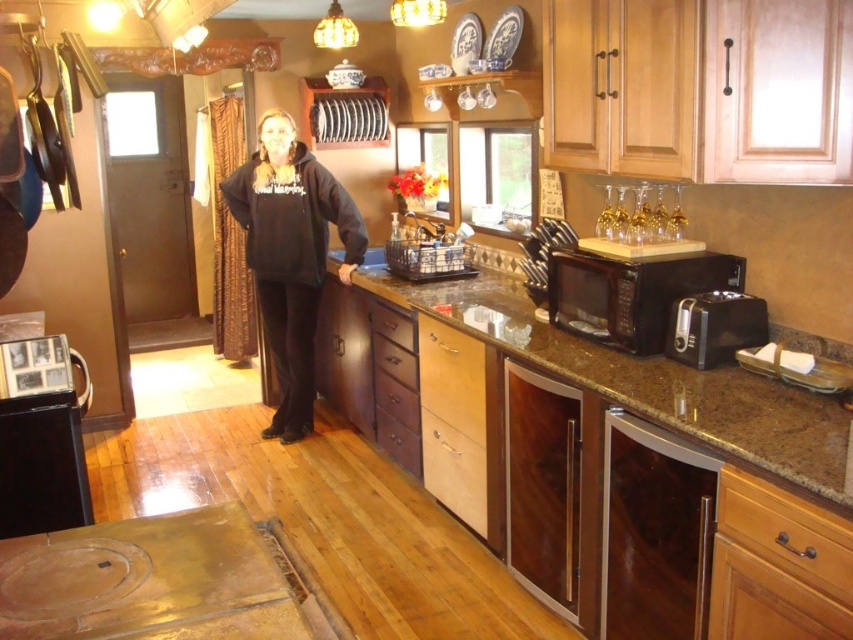
You are standing in the kitchen and want to load dishes into the satin stainless steel dishwasher at lower right. If your reach is 6 feet, can you place dishes into it without moving closer?

The satin stainless steel dishwasher at lower right is 6.21 feet away from you, which is slightly beyond your 6 feet reach. You need to move closer to reach it.

You are standing in the kitchen and want to place a cutting board on the closest surface between the brown granite countertop at center and the satin stainless steel dishwasher at lower right. Which surface should you choose?

You should choose the brown granite countertop at center because it is closer to the viewer than the satin stainless steel dishwasher at lower right.